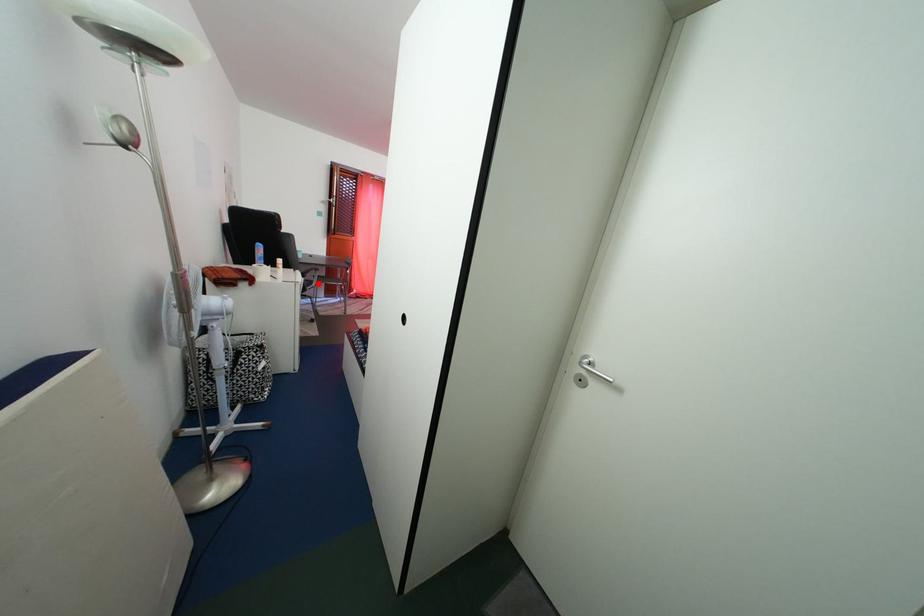
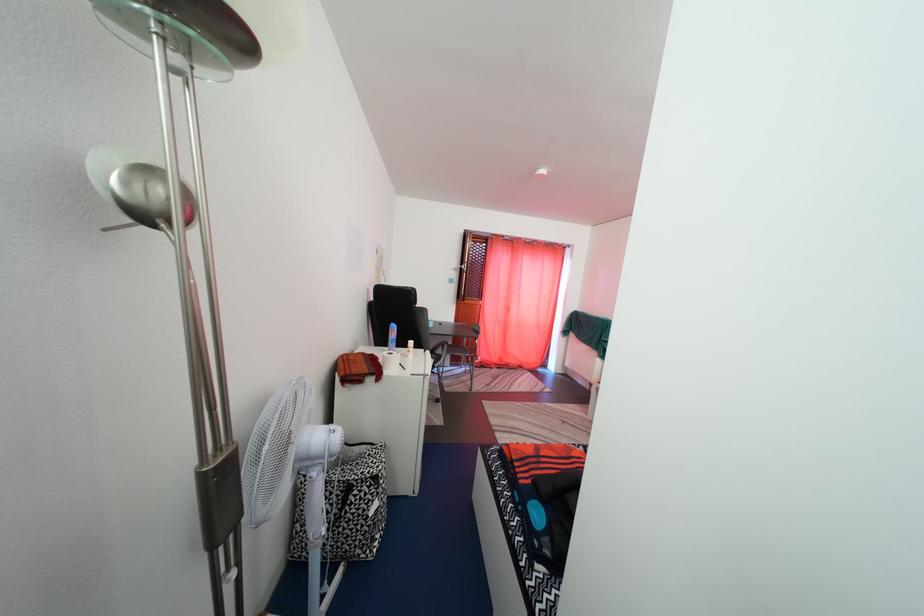
Find the pixel in the second image that matches the highlighted location in the first image.

(447, 359)